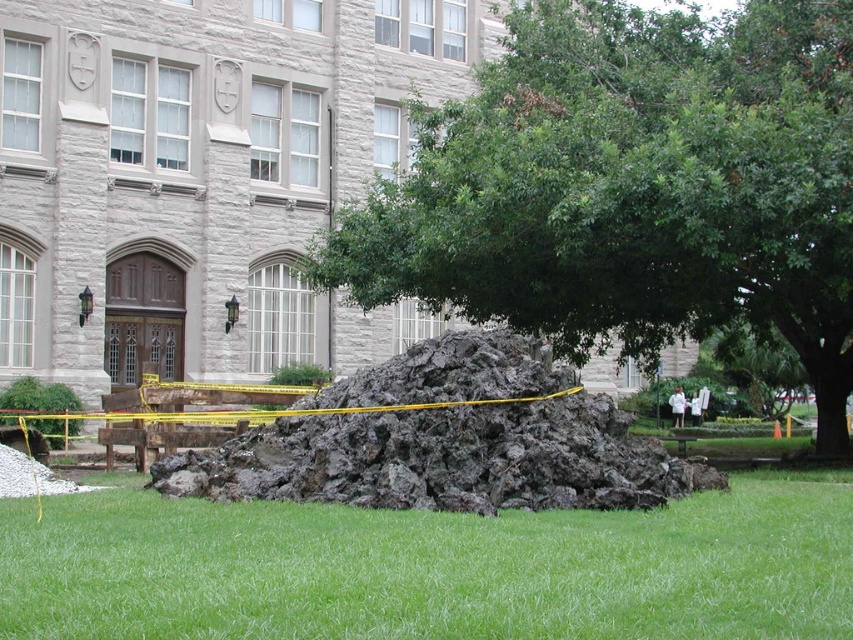
Question: Observing the image, what is the correct spatial positioning of green leafy tree at center in reference to green grass at lower center?

Choices:
 (A) above
 (B) below

Answer: (A)

Question: Is the position of green leafy tree at center more distant than that of green grass at lower center?

Choices:
 (A) no
 (B) yes

Answer: (B)

Question: From the image, what is the correct spatial relationship of green grass at lower center in relation to dark gray rock at center?

Choices:
 (A) right
 (B) left

Answer: (A)

Question: Among these objects, which one is nearest to the camera?

Choices:
 (A) green leafy tree at center
 (B) green grass at lower center
 (C) dark gray rock at center

Answer: (B)

Question: Considering the real-world distances, which object is closest to the dark gray rock at center?

Choices:
 (A) green leafy tree at center
 (B) green grass at lower center

Answer: (B)

Question: Which of the following is the farthest from the observer?

Choices:
 (A) (764, 563)
 (B) (500, 422)

Answer: (B)